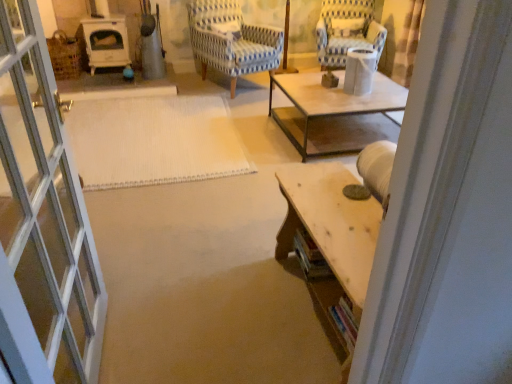
I want to click on free point above wooden table at lower right (from a real-world perspective), so click(337, 205).